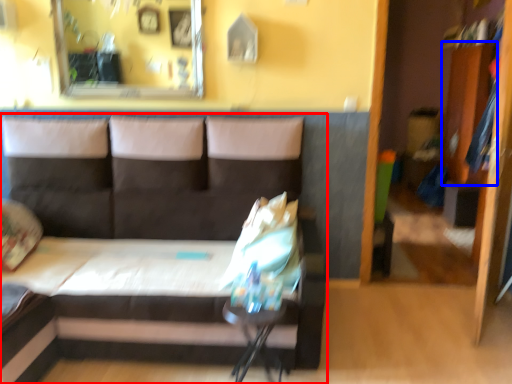
Question: Which point is closer to the camera, studio couch (highlighted by a red box) or dresser (highlighted by a blue box)?

Choices:
 (A) studio couch
 (B) dresser

Answer: (A)